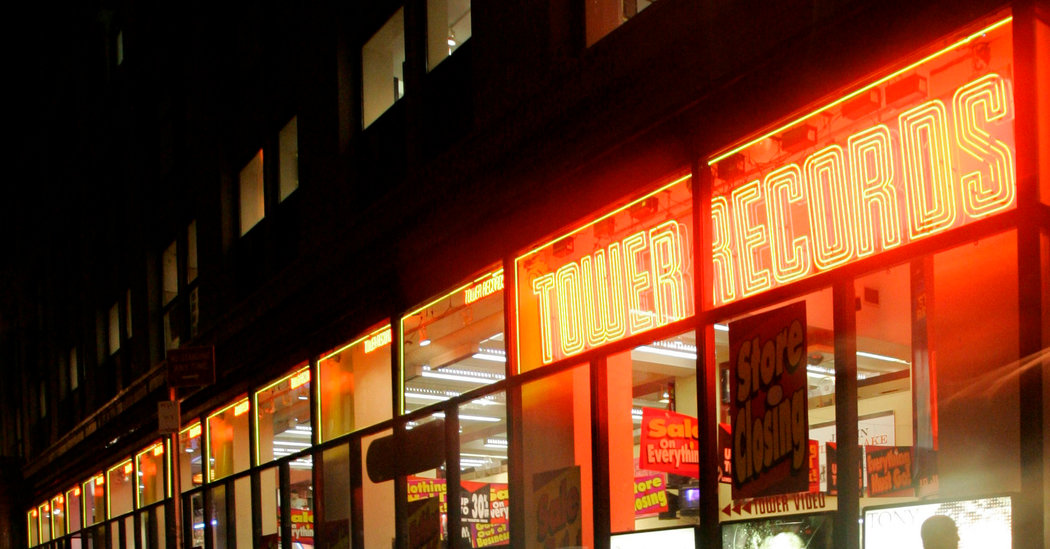
Identify the location of red sale on everything ceiling banner. The height and width of the screenshot is (549, 1050). (669, 449).